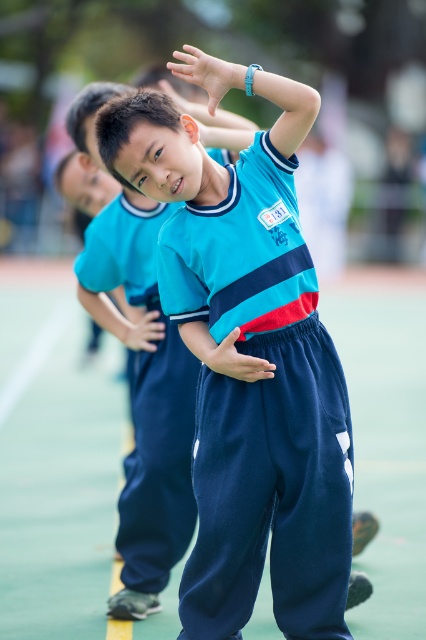
Can you confirm if matte blue pants at center is wider than matte blue hand at upper center?

Yes, matte blue pants at center is wider than matte blue hand at upper center.

Does matte blue pants at center appear under matte blue hand at upper center?

Yes.

Where is `matte blue pants at center`? The height and width of the screenshot is (640, 426). matte blue pants at center is located at coordinates (230, 356).

You are a GUI agent. You are given a task and a screenshot of the screen. Output one action in this format:
    pyautogui.click(x=<x>, y=<y>)
    Task: Click on the matte blue pants at center
    This screenshot has height=640, width=426.
    Given the screenshot: What is the action you would take?
    pyautogui.click(x=230, y=356)

Is blue fabric uniform at center taller than matte blue hand at upper center?

Yes, blue fabric uniform at center is taller than matte blue hand at upper center.

Does blue fabric uniform at center have a larger size compared to matte blue hand at upper center?

Yes.

Which is in front, point (192, 524) or point (180, 97)?

Point (192, 524) is in front.

The image size is (426, 640). Identify the location of blue fabric uniform at center. (147, 397).

Does blue fabric uniform at center come behind matte blue pants at center?

That is True.

Is blue fabric uniform at center wider than matte blue pants at center?

Yes, blue fabric uniform at center is wider than matte blue pants at center.

Between point (120, 496) and point (238, 368), which one is positioned behind?

Positioned behind is point (120, 496).

Identify the location of blue fabric uniform at center. The image size is (426, 640). (147, 397).